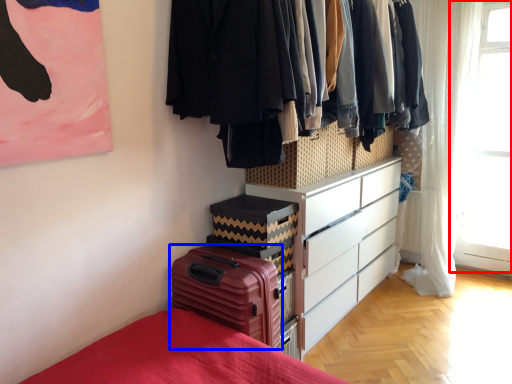
Question: Which point is further to the camera, window screen (highlighted by a red box) or suitcase (highlighted by a blue box)?

Choices:
 (A) window screen
 (B) suitcase

Answer: (A)